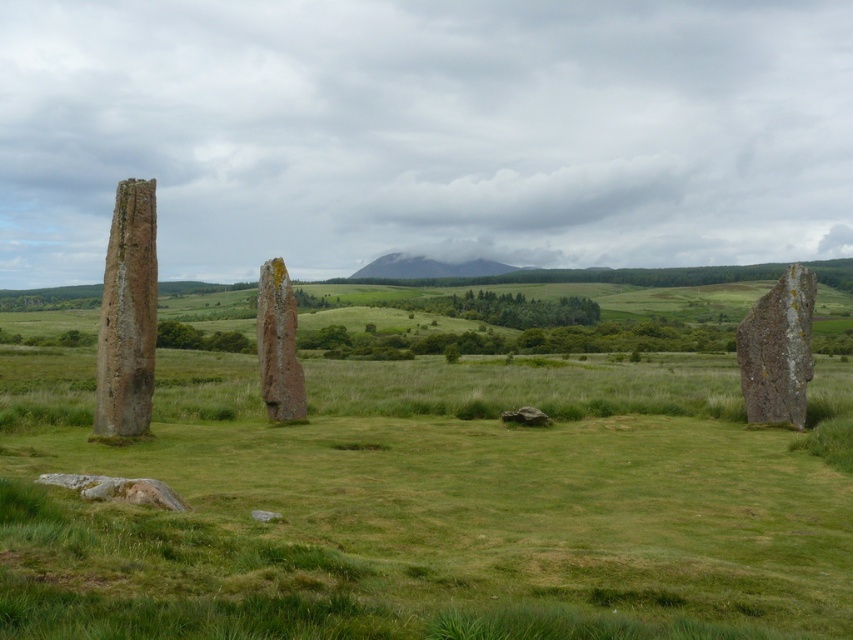
Which is more to the right, smooth gray stone at right or rusty stone pillar at center?

smooth gray stone at right is more to the right.

Can you confirm if smooth gray stone at right is positioned to the right of rusty stone pillar at center?

Correct, you'll find smooth gray stone at right to the right of rusty stone pillar at center.

Which is in front, point (791, 394) or point (279, 404)?

Positioned in front is point (791, 394).

At what (x,y) coordinates should I click in order to perform the action: click on smooth gray stone at right. Please return your answer as a coordinate pair (x, y). This screenshot has height=640, width=853. Looking at the image, I should click on (778, 349).

Who is higher up, rustic stone pillar at left or rusty stone pillar at center?

rustic stone pillar at left is above.

Does rustic stone pillar at left have a larger size compared to rusty stone pillar at center?

Indeed, rustic stone pillar at left has a larger size compared to rusty stone pillar at center.

Does point (112, 248) lie in front of point (265, 324)?

That is True.

Where is `rustic stone pillar at left`? The height and width of the screenshot is (640, 853). rustic stone pillar at left is located at coordinates (126, 316).

Which of these two, rustic stone pillar at left or smooth gray stone at right, stands taller?

Standing taller between the two is rustic stone pillar at left.

What do you see at coordinates (126, 316) in the screenshot? I see `rustic stone pillar at left` at bounding box center [126, 316].

You are a GUI agent. You are given a task and a screenshot of the screen. Output one action in this format:
    pyautogui.click(x=<x>, y=<y>)
    Task: Click on the rustic stone pillar at left
    The width and height of the screenshot is (853, 640).
    Given the screenshot: What is the action you would take?
    pyautogui.click(x=126, y=316)